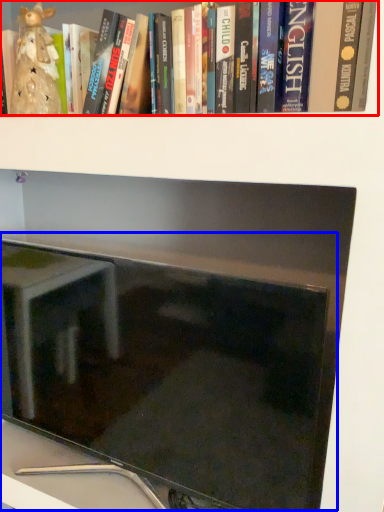
Question: Which object is closer to the camera taking this photo, book (highlighted by a red box) or computer monitor (highlighted by a blue box)?

Choices:
 (A) book
 (B) computer monitor

Answer: (A)